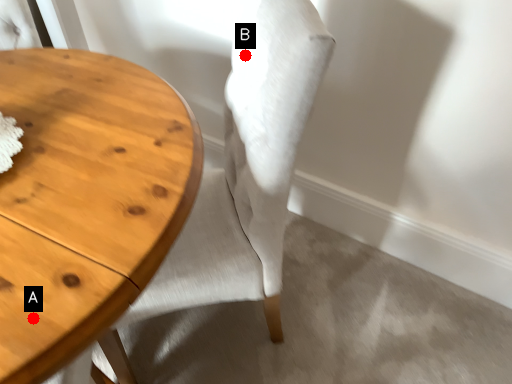
Question: Two points are circled on the image, labeled by A and B beside each circle. Which point is closer to the camera taking this photo?

Choices:
 (A) A is closer
 (B) B is closer

Answer: (A)